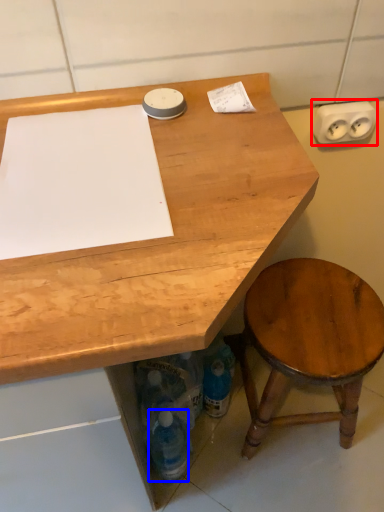
Question: Among these objects, which one is farthest to the camera, electric outlet (highlighted by a red box) or bottle (highlighted by a blue box)?

Choices:
 (A) electric outlet
 (B) bottle

Answer: (B)